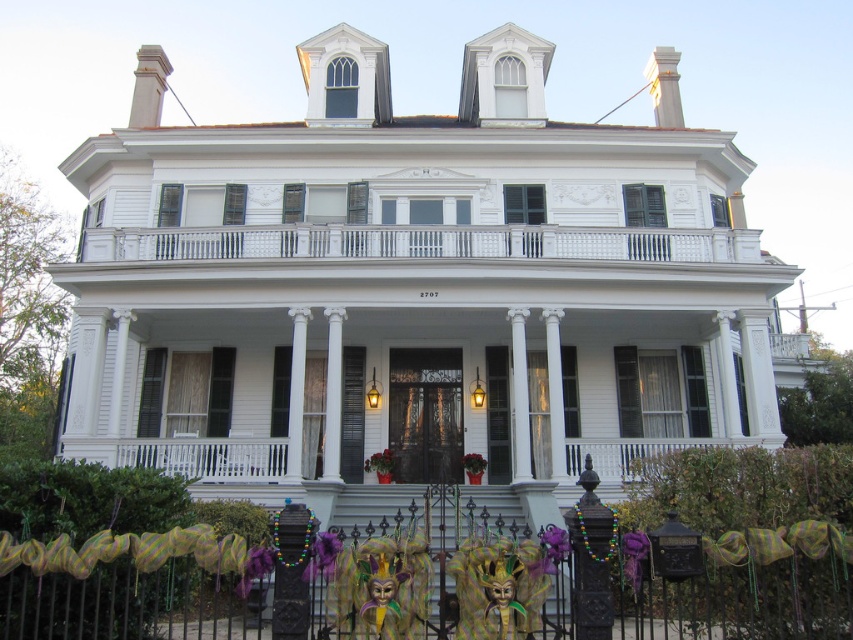
Does point (502, 604) come behind point (454, 230)?

No, it is not.

Does metallic wrought iron at lower center have a greater width compared to white painted wood railing at upper center?

No.

I want to click on metallic wrought iron at lower center, so click(x=292, y=582).

The width and height of the screenshot is (853, 640). What are the coordinates of `metallic wrought iron at lower center` in the screenshot? It's located at (292, 582).